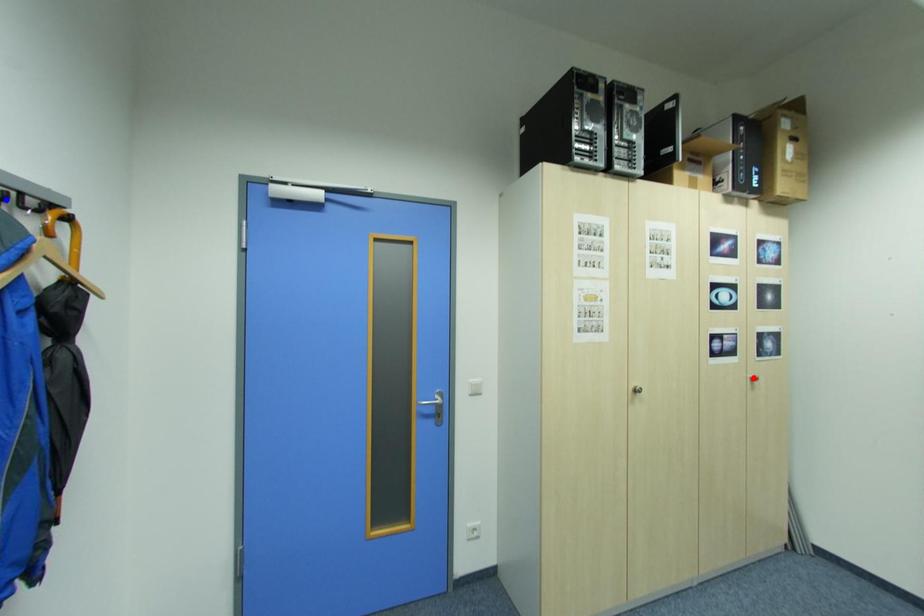
Question: In the image, two points are highlighted. Which point is nearer to the camera? Reply with the corresponding letter.

Choices:
 (A) blue point
 (B) red point

Answer: (A)